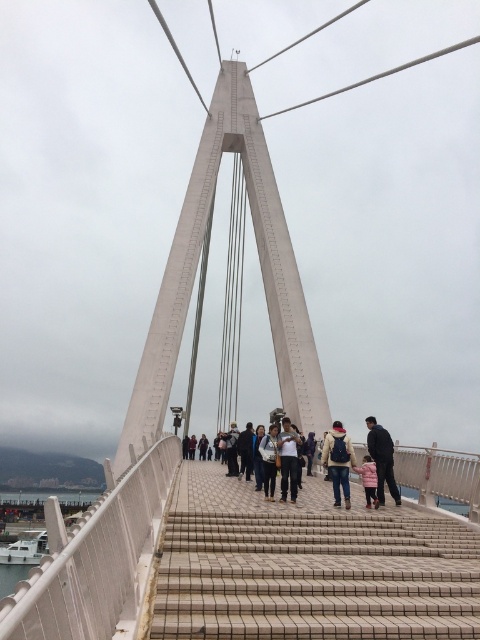
Question: Is light brown leather jacket at center above dark gray pants at center?

Choices:
 (A) no
 (B) yes

Answer: (A)

Question: Which point appears closest to the camera in this image?

Choices:
 (A) (391, 492)
 (B) (344, 483)
 (C) (269, 497)
 (D) (371, 602)

Answer: (D)

Question: Is dark gray suit at center above light brown fabric jacket at center?

Choices:
 (A) yes
 (B) no

Answer: (A)

Question: Can you confirm if light brown leather jacket at center is wider than white fleece jacket at center?

Choices:
 (A) yes
 (B) no

Answer: (A)

Question: Which point is farther to the camera?

Choices:
 (A) (361, 472)
 (B) (384, 477)
 (C) (199, 464)

Answer: (C)

Question: Estimate the real-world distances between objects in this image. Which object is closer to the dark gray fabric jacket at center?

Choices:
 (A) dark gray pants at center
 (B) light brown leather jacket at center

Answer: (A)